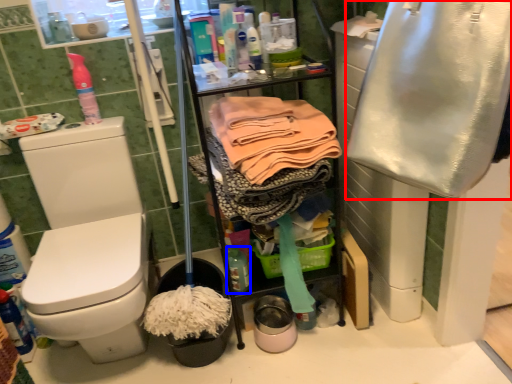
Question: Which object is further to the camera taking this photo, clothing (highlighted by a red box) or bottle (highlighted by a blue box)?

Choices:
 (A) clothing
 (B) bottle

Answer: (B)